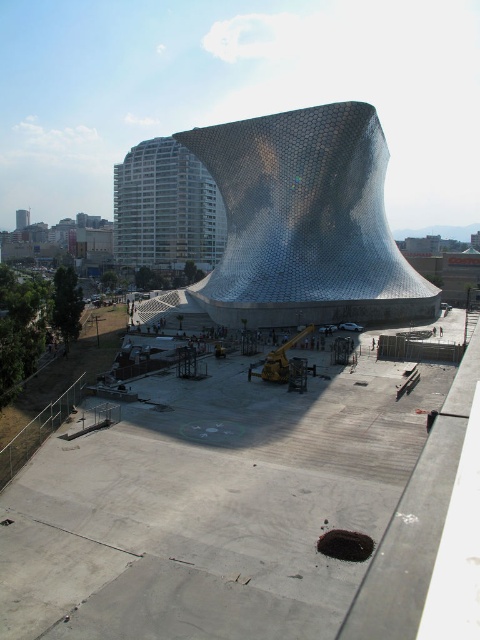
Question: Is white glass building at upper left smaller than matte gray concrete bench at center?

Choices:
 (A) no
 (B) yes

Answer: (A)

Question: Where is concrete at center located in relation to white glass building at upper left in the image?

Choices:
 (A) above
 (B) below

Answer: (B)

Question: Which point is farther to the camera?

Choices:
 (A) (48, 525)
 (B) (233, 140)
 (C) (207, 422)

Answer: (B)

Question: Does white glass building at upper left appear over matte gray concrete bench at center?

Choices:
 (A) no
 (B) yes

Answer: (B)

Question: Which point is farther to the camera?

Choices:
 (A) (192, 154)
 (B) (472, 339)
 (C) (356, 241)

Answer: (A)

Question: Which of these objects is positioned closest to the white glass building at upper left?

Choices:
 (A) concrete at center
 (B) metallic honeycomb structure at center
 (C) matte gray concrete bench at center

Answer: (B)